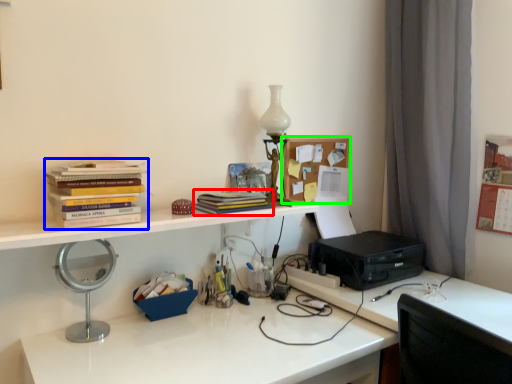
Question: Which is farther away from book (highlighted by a red box)? book (highlighted by a blue box) or shelf (highlighted by a green box)?

Choices:
 (A) book
 (B) shelf

Answer: (A)